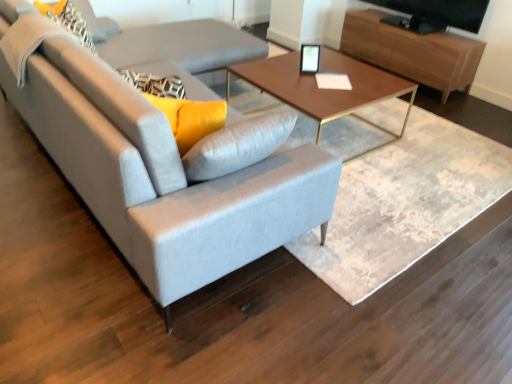
Question: From the image's perspective, is matte black picture frame at center above or below light gray fabric couch at center?

Choices:
 (A) below
 (B) above

Answer: (B)

Question: Is point (310, 62) closer or farther from the camera than point (198, 155)?

Choices:
 (A) farther
 (B) closer

Answer: (A)

Question: Estimate the real-world distances between objects in this image. Which object is farther from the light gray fabric couch at center?

Choices:
 (A) wooden/metallic coffee table at center
 (B) wooden entertainment center at upper right
 (C) matte black picture frame at center
 (D) black glossy tv at upper right

Answer: (D)

Question: Which object is the farthest from the wooden/metallic coffee table at center?

Choices:
 (A) black glossy tv at upper right
 (B) light gray fabric couch at center
 (C) wooden entertainment center at upper right
 (D) matte black picture frame at center

Answer: (A)